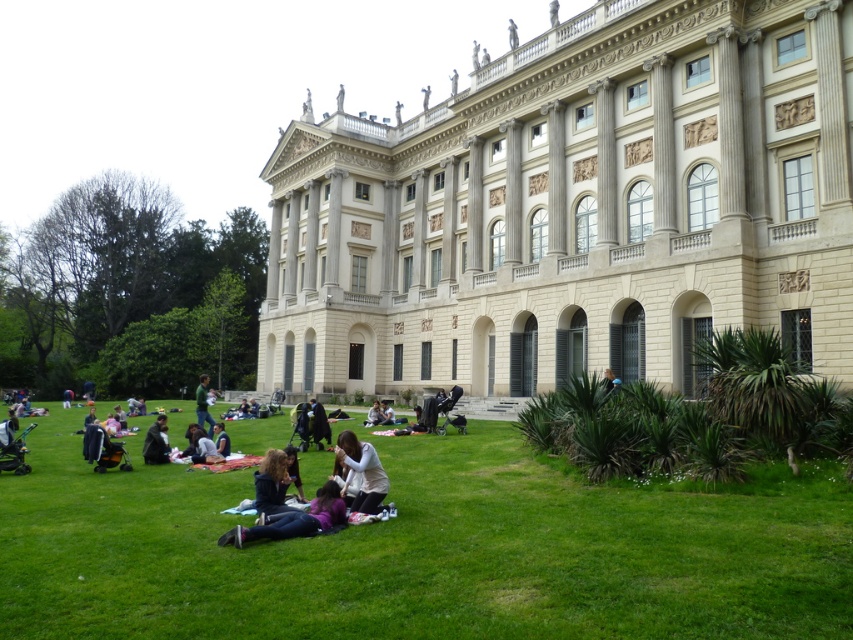
What are the coordinates of `green grass at lower center` in the screenshot? It's located at (424, 550).

Who is positioned more to the right, green grass at lower center or light gray fabric at center?

Positioned to the right is green grass at lower center.

Is point (64, 570) closer to viewer compared to point (202, 452)?

Yes, point (64, 570) is closer to viewer.

Locate an element on the screen. green grass at lower center is located at coordinates (424, 550).

Is dark blue jeans at lower center below dark matte coat at center?

Correct, dark blue jeans at lower center is located below dark matte coat at center.

Does dark blue jeans at lower center have a lesser width compared to dark matte coat at center?

Correct, dark blue jeans at lower center's width is less than dark matte coat at center's.

Is point (305, 522) positioned after point (320, 406)?

No, it is not.

Find the location of a particular element. dark blue jeans at lower center is located at coordinates (294, 518).

Can you confirm if dark blue jeans at lower center is positioned to the right of green fabric jacket at lower left?

Correct, you'll find dark blue jeans at lower center to the right of green fabric jacket at lower left.

This screenshot has width=853, height=640. What do you see at coordinates (294, 518) in the screenshot?
I see `dark blue jeans at lower center` at bounding box center [294, 518].

Describe the element at coordinates (294, 518) in the screenshot. I see `dark blue jeans at lower center` at that location.

Find the location of a particular element. The image size is (853, 640). dark blue jeans at lower center is located at coordinates (294, 518).